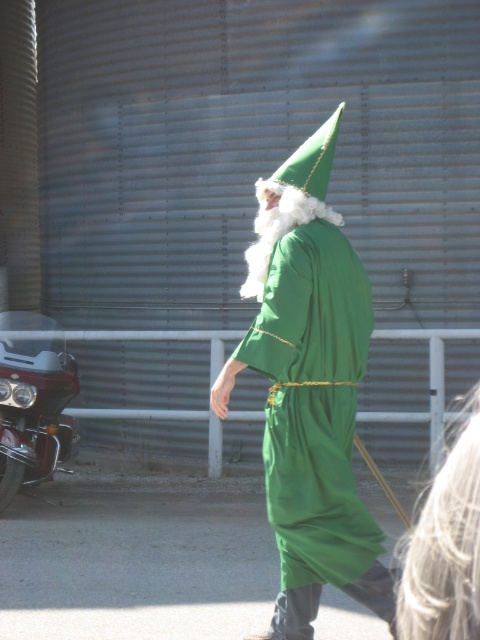
Who is positioned more to the left, green matte/golden trim wizard hat at center or shiny chrome motorcycle at left?

shiny chrome motorcycle at left

Is green matte/golden trim wizard hat at center above shiny chrome motorcycle at left?

Correct, green matte/golden trim wizard hat at center is located above shiny chrome motorcycle at left.

Identify the location of green matte/golden trim wizard hat at center. (x=310, y=388).

Locate an element on the screen. The width and height of the screenshot is (480, 640). green matte/golden trim wizard hat at center is located at coordinates (310, 388).